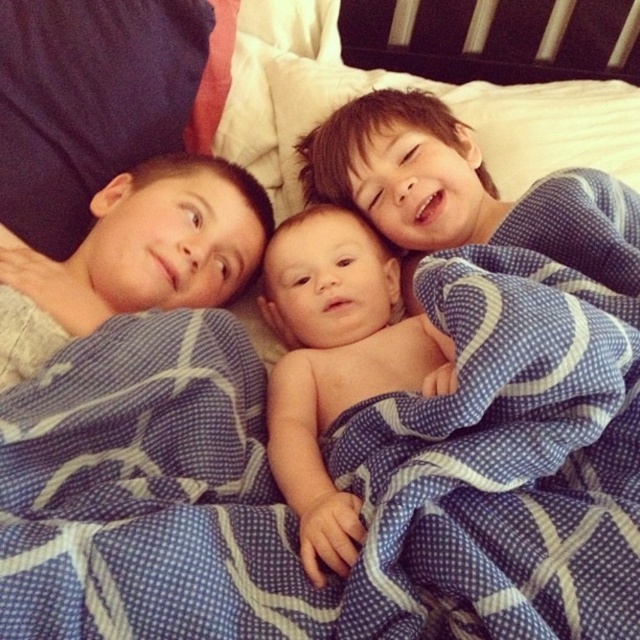
Question: Is naked baby at center below smooth skin baby at center?

Choices:
 (A) yes
 (B) no

Answer: (A)

Question: Can you confirm if naked baby at center is thinner than smooth skin baby at center?

Choices:
 (A) yes
 (B) no

Answer: (A)

Question: Which point is farther to the camera?

Choices:
 (A) (296, 381)
 (B) (209, 216)

Answer: (B)

Question: Is naked baby at center behind smooth skin baby at center?

Choices:
 (A) no
 (B) yes

Answer: (A)